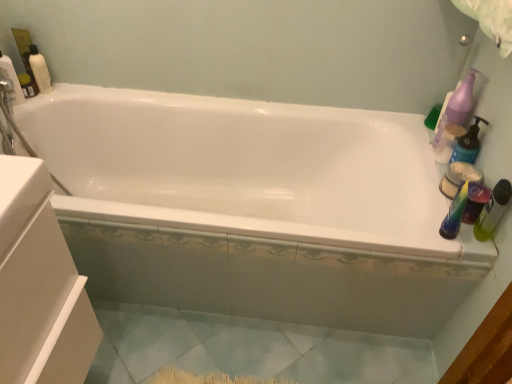
The width and height of the screenshot is (512, 384). Describe the element at coordinates (255, 208) in the screenshot. I see `white glossy bathtub at center` at that location.

The height and width of the screenshot is (384, 512). In order to click on matte plastic container at right, which is the 1th toiletry from back to front in this screenshot , I will do `click(459, 178)`.

Locate an element on the screen. Image resolution: width=512 pixels, height=384 pixels. matte white bottle at upper left, the third cleaning product in the bottom-to-top sequence is located at coordinates (39, 69).

Looking at this image, does white glossy bathtub at center contain light blue ceramic tile at lower center?

No, light blue ceramic tile at lower center is not a part of white glossy bathtub at center.

Which of these two, white glossy bathtub at center or light blue ceramic tile at lower center, is smaller?

light blue ceramic tile at lower center.

Does white glossy bathtub at center have a greater height compared to light blue ceramic tile at lower center?

Indeed, white glossy bathtub at center has a greater height compared to light blue ceramic tile at lower center.

Is matte purple pump bottle at right, placed as the 3th cleaning product when sorted from top to bottom, directly adjacent to matte white bottle at upper left, arranged as the 3th cleaning product when viewed from the right?

No, matte purple pump bottle at right, placed as the 3th cleaning product when sorted from top to bottom, is not beside matte white bottle at upper left, arranged as the 3th cleaning product when viewed from the right.

From the image's perspective, between matte purple pump bottle at right, placed as the 3th cleaning product when sorted from top to bottom, and matte white bottle at upper left, arranged as the 3th cleaning product when viewed from the right, who is located below?

matte purple pump bottle at right, placed as the 3th cleaning product when sorted from top to bottom, is shown below in the image.

Which point is more forward, [455,152] or [46,88]?

The point [455,152] is closer.

Is matte purple pump bottle at right, placed as the 2th cleaning product when sorted from right to left, at the right side of matte white bottle at upper left, which is the first cleaning product in left-to-right order?

Yes, matte purple pump bottle at right, placed as the 2th cleaning product when sorted from right to left, is to the right of matte white bottle at upper left, which is the first cleaning product in left-to-right order.

Considering the sizes of translucent green bottle at right, acting as the second toiletry starting from the back, and matte plastic container at right, which is the 1th toiletry from back to front, in the image, is translucent green bottle at right, acting as the second toiletry starting from the back, bigger or smaller than matte plastic container at right, which is the 1th toiletry from back to front,?

In the image, translucent green bottle at right, acting as the second toiletry starting from the back, appears to be smaller than matte plastic container at right, which is the 1th toiletry from back to front.

From a real-world perspective, who is located lower, translucent green bottle at right, which is the 1th toiletry in front-to-back order, or matte plastic container at right, which is the 1th toiletry from back to front?

From a 3D spatial view, matte plastic container at right, which is the 1th toiletry from back to front, is below.

What's the angular difference between translucent green bottle at right, acting as the second toiletry starting from the back, and matte plastic container at right, which is the 2th toiletry from front to back,'s facing directions?

translucent green bottle at right, acting as the second toiletry starting from the back, and matte plastic container at right, which is the 2th toiletry from front to back, are facing 0.000162 degrees away from each other.

In the scene shown: Is matte white bottle at upper left, the 1th cleaning product viewed from the top, wider or thinner than matte plastic container at right, which is the 2th toiletry from front to back?

Considering their sizes, matte white bottle at upper left, the 1th cleaning product viewed from the top, looks slimmer than matte plastic container at right, which is the 2th toiletry from front to back.

Considering the relative sizes of matte white bottle at upper left, the 1th cleaning product viewed from the top, and matte plastic container at right, which is the 2th toiletry from front to back, in the image provided, is matte white bottle at upper left, the 1th cleaning product viewed from the top, taller than matte plastic container at right, which is the 2th toiletry from front to back,?

Indeed, matte white bottle at upper left, the 1th cleaning product viewed from the top, has a greater height compared to matte plastic container at right, which is the 2th toiletry from front to back.

Are matte white bottle at upper left, the 1th cleaning product viewed from the top, and matte plastic container at right, which is the 1th toiletry from back to front, far apart?

Yes, matte white bottle at upper left, the 1th cleaning product viewed from the top, and matte plastic container at right, which is the 1th toiletry from back to front, are located far from each other.

Which is less distant, (42, 75) or (473, 177)?

Point (42, 75) appears to be farther away from the viewer than point (473, 177).

Considering their positions, is matte plastic container at right, which is the 2th toiletry from front to back, located in front of or behind matte white bottle at upper left, arranged as the 3th cleaning product when viewed from the right?

In the image, matte plastic container at right, which is the 2th toiletry from front to back, appears in front of matte white bottle at upper left, arranged as the 3th cleaning product when viewed from the right.

From the image's perspective, which is below, matte plastic container at right, which is the 1th toiletry from back to front, or matte white bottle at upper left, arranged as the 3th cleaning product when viewed from the right?

matte plastic container at right, which is the 1th toiletry from back to front.

Between matte plastic container at right, which is the 2th toiletry from front to back, and matte white bottle at upper left, the 1th cleaning product viewed from the top, which one has more height?

matte white bottle at upper left, the 1th cleaning product viewed from the top, is taller.

Which is correct: matte plastic container at right, which is the 1th toiletry from back to front, is inside white glossy bathtub at center, or outside of it?

matte plastic container at right, which is the 1th toiletry from back to front, cannot be found inside white glossy bathtub at center.

Who is taller, matte plastic container at right, which is the 1th toiletry from back to front, or white glossy bathtub at center?

white glossy bathtub at center.

From the image's perspective, which is below, matte plastic container at right, which is the 1th toiletry from back to front, or white glossy bathtub at center?

From the image's view, white glossy bathtub at center is below.

Can you tell me how much matte plastic container at right, which is the 2th toiletry from front to back, and white glossy bathtub at center differ in facing direction?

There is a 90-degree angle between the facing directions of matte plastic container at right, which is the 2th toiletry from front to back, and white glossy bathtub at center.

In the scene shown: Is translucent green bottle at right, which is the 1th toiletry in front-to-back order, directly adjacent to matte purple pump bottle at right, the first cleaning product ordered from the bottom?

No, translucent green bottle at right, which is the 1th toiletry in front-to-back order, is not with matte purple pump bottle at right, the first cleaning product ordered from the bottom.

Could you tell me if translucent green bottle at right, acting as the second toiletry starting from the back, is turned towards matte purple pump bottle at right, placed as the 3th cleaning product when sorted from top to bottom?

No, translucent green bottle at right, acting as the second toiletry starting from the back, is not facing towards matte purple pump bottle at right, placed as the 3th cleaning product when sorted from top to bottom.

Is translucent green bottle at right, which is the 1th toiletry in front-to-back order, in front of or behind matte purple pump bottle at right, acting as the 2th cleaning product starting from the left, in the image?

In the image, translucent green bottle at right, which is the 1th toiletry in front-to-back order, appears in front of matte purple pump bottle at right, acting as the 2th cleaning product starting from the left.

This screenshot has width=512, height=384. In order to click on bathtub that appears in front of the light blue ceramic tile at lower center in this screenshot , I will do `click(255, 208)`.

At what (x,y) coordinates should I click in order to perform the action: click on the 2nd cleaning product behind the matte purple pump bottle at right, the first cleaning product ordered from the bottom. Please return your answer as a coordinate pair (x, y). Looking at the image, I should click on (39, 69).

Which object lies nearer to the anchor point white glossy bathtub at center, matte plastic container at right, which is the 2th toiletry from front to back, or purple plastic pump bottle at upper right, which is counted as the third cleaning product, starting from the left?

purple plastic pump bottle at upper right, which is counted as the third cleaning product, starting from the left, is positioned closer to the anchor white glossy bathtub at center.

In the scene shown: Considering their positions, is matte purple pump bottle at right, the first cleaning product ordered from the bottom, positioned closer to matte white bottle at upper left, which is the first cleaning product in left-to-right order, than translucent green bottle at right, acting as the second toiletry starting from the back?

Based on the image, matte purple pump bottle at right, the first cleaning product ordered from the bottom, appears to be nearer to matte white bottle at upper left, which is the first cleaning product in left-to-right order.

When comparing their distances from matte white bottle at upper left, which is the first cleaning product in left-to-right order, does light blue ceramic tile at lower center or purple plastic pump bottle at upper right, which is counted as the third cleaning product, starting from the left, seem closer?

light blue ceramic tile at lower center is closer to matte white bottle at upper left, which is the first cleaning product in left-to-right order.

From the image, which object appears to be nearer to white glossy bathtub at center, purple plastic pump bottle at upper right, acting as the second cleaning product starting from the top, or matte purple pump bottle at right, the first cleaning product ordered from the bottom?

purple plastic pump bottle at upper right, acting as the second cleaning product starting from the top, is closer to white glossy bathtub at center.

In the scene shown: Based on their spatial positions, is translucent green bottle at right, which is the 1th toiletry in front-to-back order, or white glossy bathtub at center closer to purple plastic pump bottle at upper right, the 1th cleaning product viewed from the right?

translucent green bottle at right, which is the 1th toiletry in front-to-back order.

From the picture: From the image, which object appears to be nearer to matte purple pump bottle at right, placed as the 3th cleaning product when sorted from top to bottom, matte plastic container at right, which is the 1th toiletry from back to front, or white glossy bathtub at center?

matte plastic container at right, which is the 1th toiletry from back to front, is positioned closer to the anchor matte purple pump bottle at right, placed as the 3th cleaning product when sorted from top to bottom.

From the image, which object appears to be farther from matte plastic container at right, which is the 2th toiletry from front to back, translucent green bottle at right, acting as the second toiletry starting from the back, or matte white bottle at upper left, which is the first cleaning product in left-to-right order?

matte white bottle at upper left, which is the first cleaning product in left-to-right order.

From the image, which object appears to be farther from light blue ceramic tile at lower center, white glossy bathtub at center or translucent green bottle at right, which is the 1th toiletry in front-to-back order?

translucent green bottle at right, which is the 1th toiletry in front-to-back order, is positioned further to the anchor light blue ceramic tile at lower center.

At what (x,y) coordinates should I click in order to perform the action: click on cleaning product situated between matte white bottle at upper left, which is the first cleaning product in left-to-right order, and purple plastic pump bottle at upper right, placed as the 2th cleaning product when sorted from bottom to top, from left to right. Please return your answer as a coordinate pair (x, y). Looking at the image, I should click on (468, 144).

You are a GUI agent. You are given a task and a screenshot of the screen. Output one action in this format:
    pyautogui.click(x=<x>, y=<y>)
    Task: Click on the cleaning product located between translucent green bottle at right, which is the 1th toiletry in front-to-back order, and matte plastic container at right, which is the 1th toiletry from back to front, in the depth direction
    This screenshot has height=384, width=512.
    Given the screenshot: What is the action you would take?
    pyautogui.click(x=468, y=144)

Find the location of `toiletry situated between white glossy bathtub at center and translucent green bottle at right, acting as the second toiletry starting from the back, from left to right`. toiletry situated between white glossy bathtub at center and translucent green bottle at right, acting as the second toiletry starting from the back, from left to right is located at coordinates (459, 178).

In order to click on cleaning product between purple plastic pump bottle at upper right, placed as the 2th cleaning product when sorted from bottom to top, and matte plastic container at right, which is the 1th toiletry from back to front, in the vertical direction in this screenshot , I will do `click(468, 144)`.